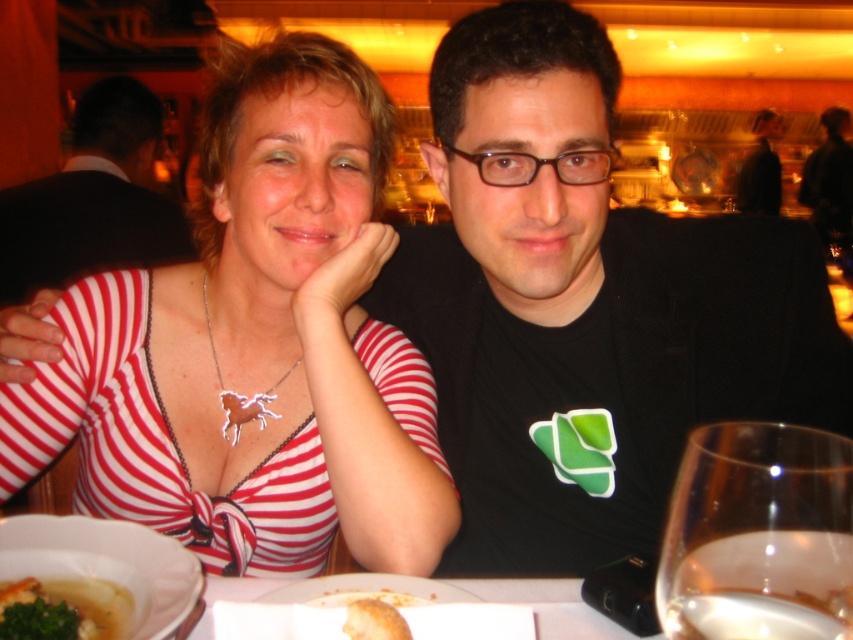
From the picture: You are a waiter in a restaurant and need to serve a customer who is allergic to dairy. The customer is seated at a table where you see the white creamy soup at lower left and the brown plastic glasses at center. Which item should you avoid placing near the customer?

The white creamy soup at lower left contains dairy and should be avoided near the customer. The brown plastic glasses at center are safe to use as they are nonreactive and unrelated to dairy allergies.

You are a photographer standing at the origin point of the coordinate system. You want to take a photo of the black matte shirt at center. What are the coordinates where you should aim your camera?

The coordinates to aim the camera are at point (598, 356).

You are a restaurant server trying to place a new order on the table. The order includes a large dessert that requires a space wider than the black matte shirt at center. Can the white ceramic plate at lower left accommodate the dessert?

The black matte shirt at center is wider than the white ceramic plate at lower left, so the dessert cannot be placed on the white ceramic plate at lower left since it is narrower than the shirt.